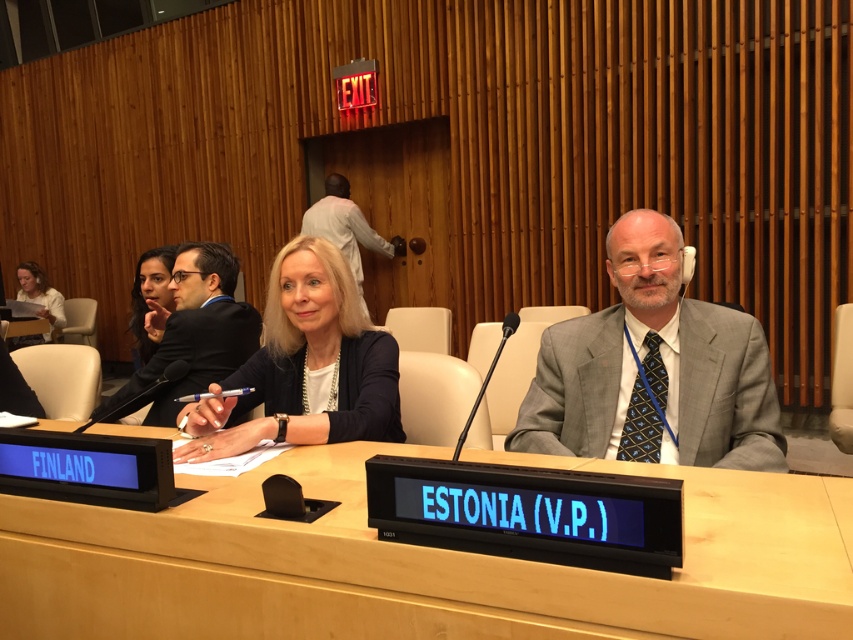
Question: Which object appears closest to the camera in this image?

Choices:
 (A) wooden table at center
 (B) matte black blazer at center
 (C) gray suit at center
 (D) matte white paper at left

Answer: (A)

Question: Which is nearer to the gray suit at center?

Choices:
 (A) matte black hair at upper left
 (B) matte white paper at left
 (C) wooden table at center
 (D) dark suit jacket at center

Answer: (C)

Question: Does gray suit at center lie behind matte black blazer at center?

Choices:
 (A) no
 (B) yes

Answer: (A)

Question: Where is wooden table at center located in relation to light brown wood door at upper center in the image?

Choices:
 (A) right
 (B) left

Answer: (A)

Question: Is matte black blazer at center thinner than matte white paper at left?

Choices:
 (A) yes
 (B) no

Answer: (A)

Question: Which object is the farthest from the matte black blazer at center?

Choices:
 (A) light brown wood door at upper center
 (B) matte black hair at upper left
 (C) matte white paper at left
 (D) dark suit jacket at center

Answer: (C)